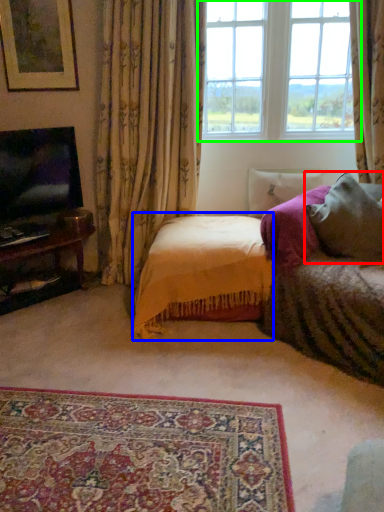
Question: Considering the real-world distances, which object is farthest from pillow (highlighted by a red box)? bedding (highlighted by a blue box) or window (highlighted by a green box)?

Choices:
 (A) bedding
 (B) window

Answer: (B)